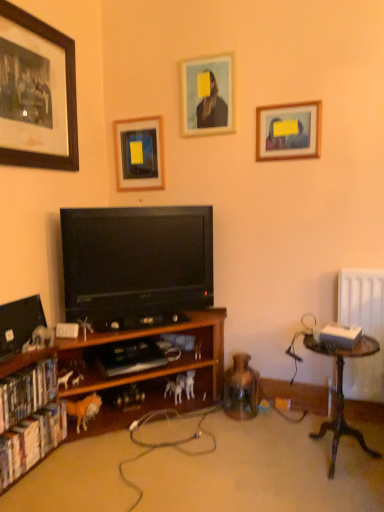
What are the coordinates of `vacant region to the left of white matte horse at lower center, the third animal when ordered from front to back` in the screenshot? It's located at (148, 412).